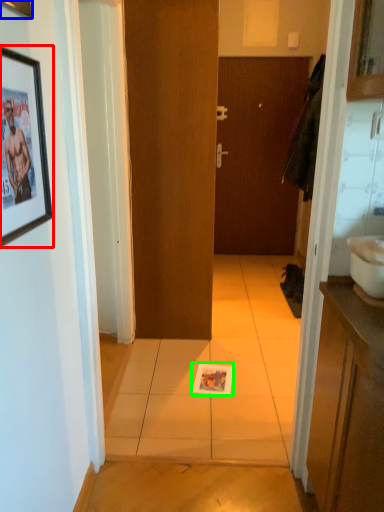
Question: Which object is the farthest from picture frame (highlighted by a red box)? Choose among these: picture frame (highlighted by a blue box) or magazine (highlighted by a green box).

Choices:
 (A) picture frame
 (B) magazine

Answer: (B)